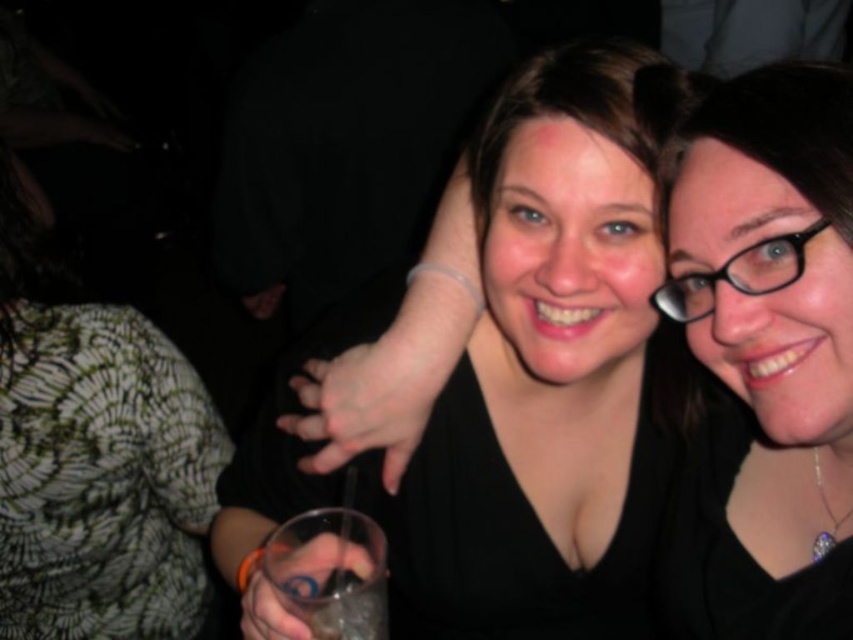
Based on the photo, can you confirm if green textured shirt at left is taller than clear plastic cup at center?

Yes, green textured shirt at left is taller than clear plastic cup at center.

Which is more to the right, green textured shirt at left or clear plastic cup at center?

clear plastic cup at center

This screenshot has height=640, width=853. What do you see at coordinates (96, 456) in the screenshot?
I see `green textured shirt at left` at bounding box center [96, 456].

Locate an element on the screen. The height and width of the screenshot is (640, 853). green textured shirt at left is located at coordinates tap(96, 456).

Is black matte/black shirt at center below green textured shirt at left?

No.

Is black matte/black shirt at center to the left of green textured shirt at left from the viewer's perspective?

Incorrect, black matte/black shirt at center is not on the left side of green textured shirt at left.

What do you see at coordinates (763, 356) in the screenshot? I see `black matte/black shirt at center` at bounding box center [763, 356].

The image size is (853, 640). In order to click on black matte/black shirt at center in this screenshot , I will do `click(763, 356)`.

Can you confirm if clear plastic cup at center is shorter than black plastic glasses at upper right?

In fact, clear plastic cup at center may be taller than black plastic glasses at upper right.

Is clear plastic cup at center closer to camera compared to black plastic glasses at upper right?

Answer: No, clear plastic cup at center is further to the viewer.

Where is `clear plastic cup at center`? clear plastic cup at center is located at coordinates (329, 572).

Identify the location of clear plastic cup at center. [x=329, y=572].